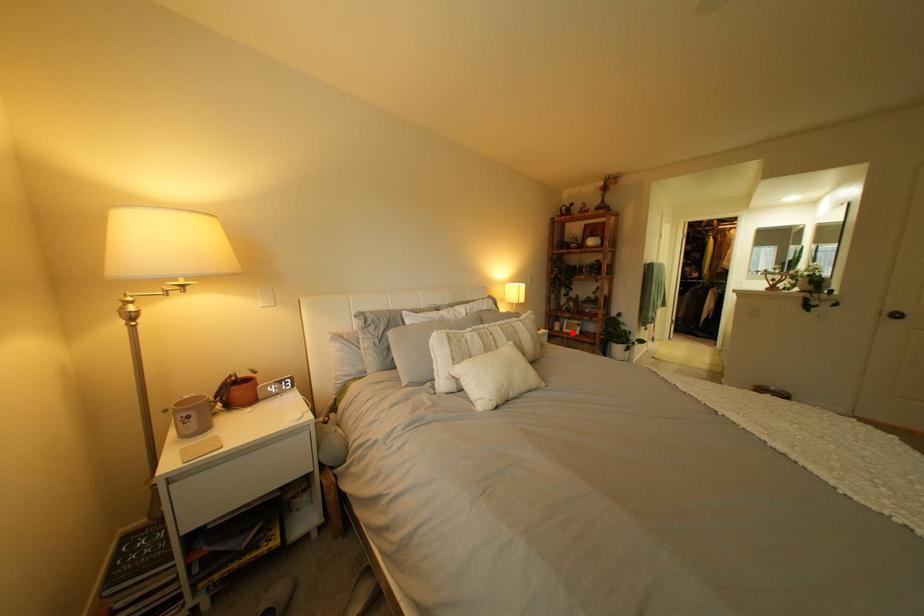
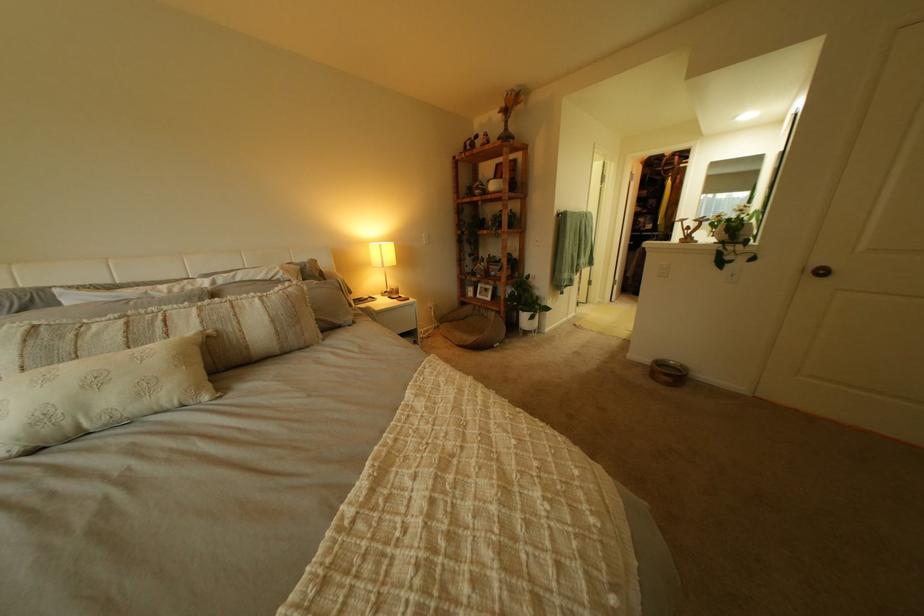
Question: I am providing you with two images of the same scene from different viewpoints. A red point is marked on the first image. Can you still see the location of the red point in image 2?

Choices:
 (A) Yes
 (B) No

Answer: (A)